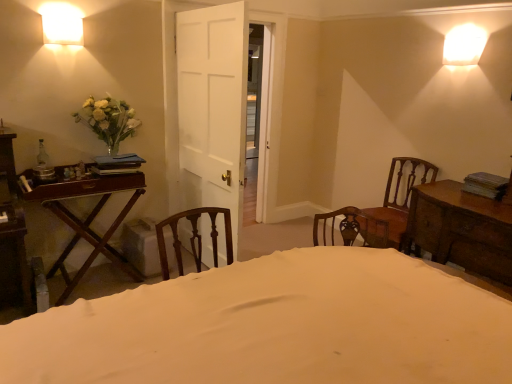
Question: Can you confirm if wooden chair at right is bigger than mahogany wood table at left, the second table from the right?

Choices:
 (A) no
 (B) yes

Answer: (A)

Question: From the image's perspective, is wooden chair at right located beneath mahogany wood table at left, the 1th table when ordered from left to right?

Choices:
 (A) no
 (B) yes

Answer: (A)

Question: Considering the relative sizes of wooden chair at right and mahogany wood table at left, the 1th table when ordered from left to right, in the image provided, is wooden chair at right shorter than mahogany wood table at left, the 1th table when ordered from left to right,?

Choices:
 (A) yes
 (B) no

Answer: (B)

Question: From the image's perspective, would you say wooden chair at right is positioned over mahogany wood table at left, the 1th table when ordered from left to right?

Choices:
 (A) yes
 (B) no

Answer: (A)

Question: Is wooden chair at right facing away from mahogany wood table at left, the 1th table when ordered from left to right?

Choices:
 (A) no
 (B) yes

Answer: (A)

Question: In terms of height, does mahogany wood table at left, the 1th table when ordered from left to right, look taller or shorter compared to white glossy wall sconce at upper left?

Choices:
 (A) short
 (B) tall

Answer: (B)

Question: Considering the positions of mahogany wood table at left, the second table from the right, and white glossy wall sconce at upper left in the image, is mahogany wood table at left, the second table from the right, bigger or smaller than white glossy wall sconce at upper left?

Choices:
 (A) big
 (B) small

Answer: (A)

Question: In terms of width, does mahogany wood table at left, the second table from the right, look wider or thinner when compared to white glossy wall sconce at upper left?

Choices:
 (A) thin
 (B) wide

Answer: (B)

Question: Do you think mahogany wood table at left, the 1th table when ordered from left to right, is within white glossy wall sconce at upper left, or outside of it?

Choices:
 (A) inside
 (B) outside

Answer: (B)

Question: From a real-world perspective, is mahogany wood table at left, the 1th table when ordered from left to right, positioned above or below white matte vase at left?

Choices:
 (A) above
 (B) below

Answer: (B)

Question: Is mahogany wood table at left, the second table from the right, inside or outside of white matte vase at left?

Choices:
 (A) inside
 (B) outside

Answer: (B)

Question: From the image's perspective, is mahogany wood table at left, the 1th table when ordered from left to right, above or below white matte vase at left?

Choices:
 (A) below
 (B) above

Answer: (A)

Question: Does point (105, 178) appear closer or farther from the camera than point (110, 109)?

Choices:
 (A) closer
 (B) farther

Answer: (A)

Question: Is white fabric bed at center inside or outside of wooden chest of drawers at right, the first table in the right-to-left sequence?

Choices:
 (A) outside
 (B) inside

Answer: (A)

Question: Is white fabric bed at center taller or shorter than wooden chest of drawers at right, the second table from the left?

Choices:
 (A) short
 (B) tall

Answer: (B)